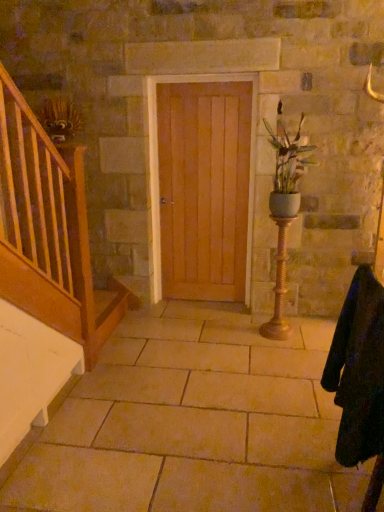
Locate an element on the screen. This screenshot has height=512, width=384. blank space situated above beige stone floor at center (from a real-world perspective) is located at coordinates (208, 379).